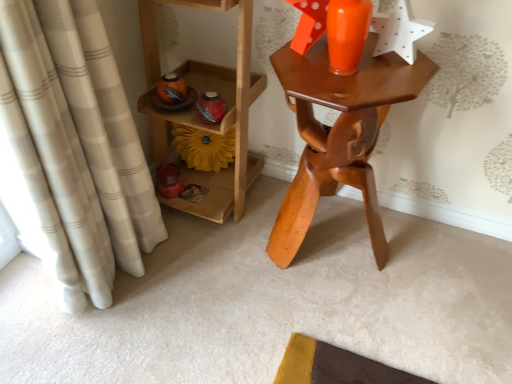
Identify the location of space that is in front of wooden shelf at left. (218, 266).